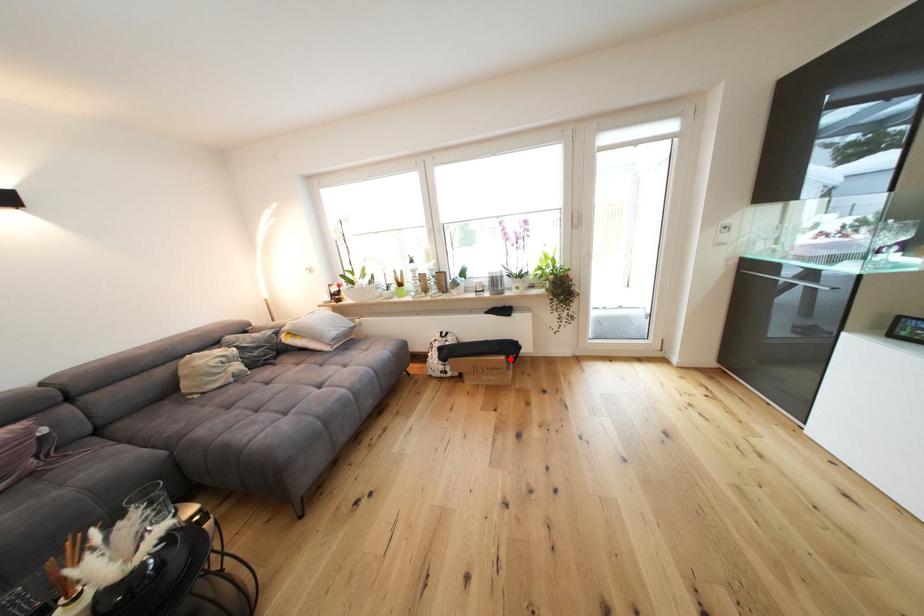
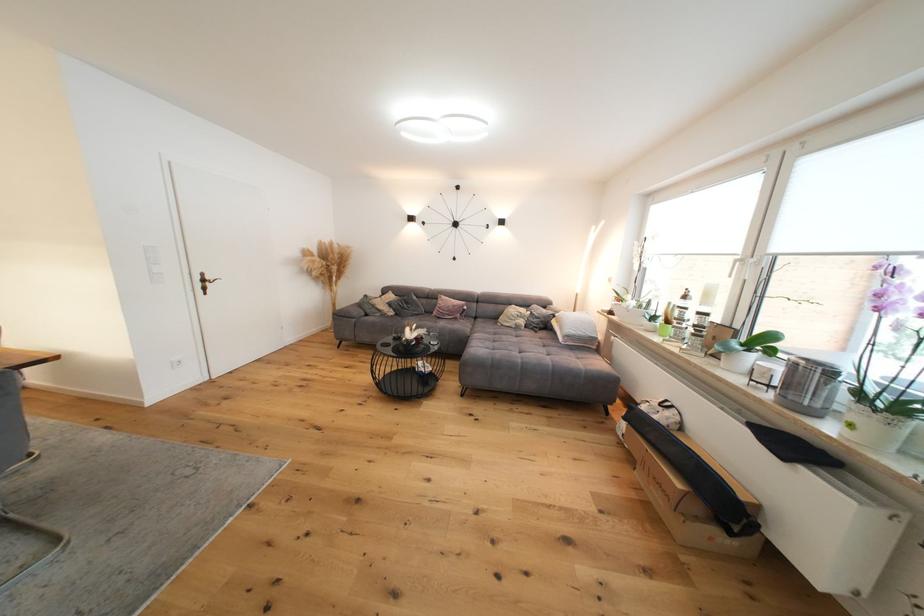
Locate, in the second image, the point that corresponds to the highlighted location in the first image.

(687, 488)